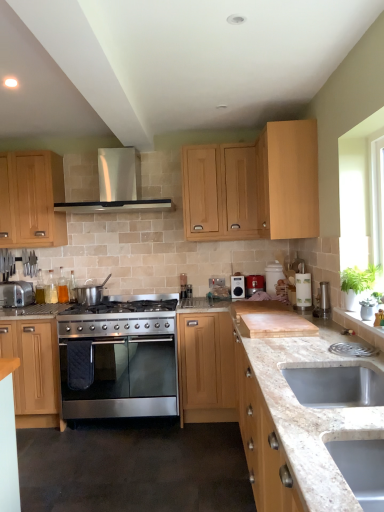
Question: Considering the relative positions of translucent glass bottles at left, arranged as the 2th appliance when viewed from the left, and satin silver pot at center, which is the second appliance in front-to-back order, in the image provided, is translucent glass bottles at left, arranged as the 2th appliance when viewed from the left, to the left of satin silver pot at center, which is the second appliance in front-to-back order, from the viewer's perspective?

Choices:
 (A) no
 (B) yes

Answer: (B)

Question: Is translucent glass bottles at left, the 5th appliance positioned from the right, thinner than satin silver pot at center, the 3th appliance viewed from the left?

Choices:
 (A) no
 (B) yes

Answer: (B)

Question: Is translucent glass bottles at left, arranged as the 1th appliance when viewed from the back, smaller than satin silver pot at center, the 3th appliance viewed from the left?

Choices:
 (A) yes
 (B) no

Answer: (A)

Question: Considering the relative positions of translucent glass bottles at left, the 5th appliance positioned from the right, and satin silver pot at center, which is the second appliance in front-to-back order, in the image provided, is translucent glass bottles at left, the 5th appliance positioned from the right, to the right of satin silver pot at center, which is the second appliance in front-to-back order, from the viewer's perspective?

Choices:
 (A) no
 (B) yes

Answer: (A)

Question: Considering the relative sizes of translucent glass bottles at left, arranged as the 2th appliance when viewed from the left, and satin silver pot at center, the 5th appliance when ordered from back to front, in the image provided, is translucent glass bottles at left, arranged as the 2th appliance when viewed from the left, wider than satin silver pot at center, the 5th appliance when ordered from back to front,?

Choices:
 (A) yes
 (B) no

Answer: (B)

Question: Is stainless steel exhaust hood at upper center bigger or smaller than translucent glass bottles at left, the 5th appliance positioned from the right?

Choices:
 (A) big
 (B) small

Answer: (A)

Question: Considering the relative positions of stainless steel exhaust hood at upper center and translucent glass bottles at left, the 5th appliance positioned from the right, in the image provided, is stainless steel exhaust hood at upper center to the left or to the right of translucent glass bottles at left, the 5th appliance positioned from the right,?

Choices:
 (A) right
 (B) left

Answer: (A)

Question: From the image's perspective, is stainless steel exhaust hood at upper center located above or below translucent glass bottles at left, arranged as the 1th appliance when viewed from the back?

Choices:
 (A) above
 (B) below

Answer: (A)

Question: Do you think stainless steel exhaust hood at upper center is within translucent glass bottles at left, the 5th appliance positioned from the right, or outside of it?

Choices:
 (A) outside
 (B) inside

Answer: (A)

Question: Is point (13, 289) positioned closer to the camera than point (372, 453)?

Choices:
 (A) closer
 (B) farther

Answer: (B)

Question: Considering their positions, is silver metallic toaster at left, the first appliance when ordered from left to right, located in front of or behind white granite countertop at lower right?

Choices:
 (A) behind
 (B) front

Answer: (A)

Question: From the image's perspective, is silver metallic toaster at left, which is the 4th appliance from back to front, located above or below white granite countertop at lower right?

Choices:
 (A) below
 (B) above

Answer: (B)

Question: Is silver metallic toaster at left, the first appliance when ordered from left to right, inside or outside of white granite countertop at lower right?

Choices:
 (A) outside
 (B) inside

Answer: (A)

Question: In terms of width, does translucent glass bottles at left, the 6th appliance when ordered from front to back, look wider or thinner when compared to light wood cabinet at upper center, acting as the 4th cabinetry starting from the left?

Choices:
 (A) thin
 (B) wide

Answer: (A)

Question: In the image, is translucent glass bottles at left, the 6th appliance when ordered from front to back, positioned in front of or behind light wood cabinet at upper center, acting as the 4th cabinetry starting from the left?

Choices:
 (A) front
 (B) behind

Answer: (B)